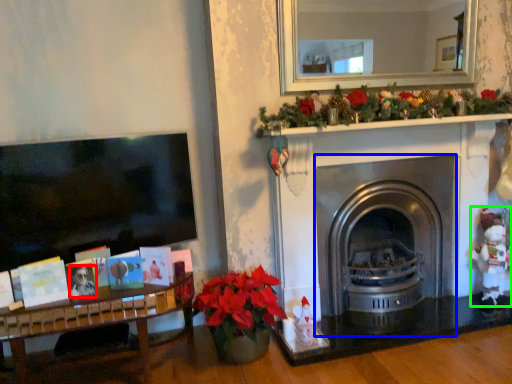
Question: Based on their relative distances, which object is nearer to person (highlighted by a red box)? Choose from fireplace (highlighted by a blue box) and toy (highlighted by a green box).

Choices:
 (A) fireplace
 (B) toy

Answer: (A)